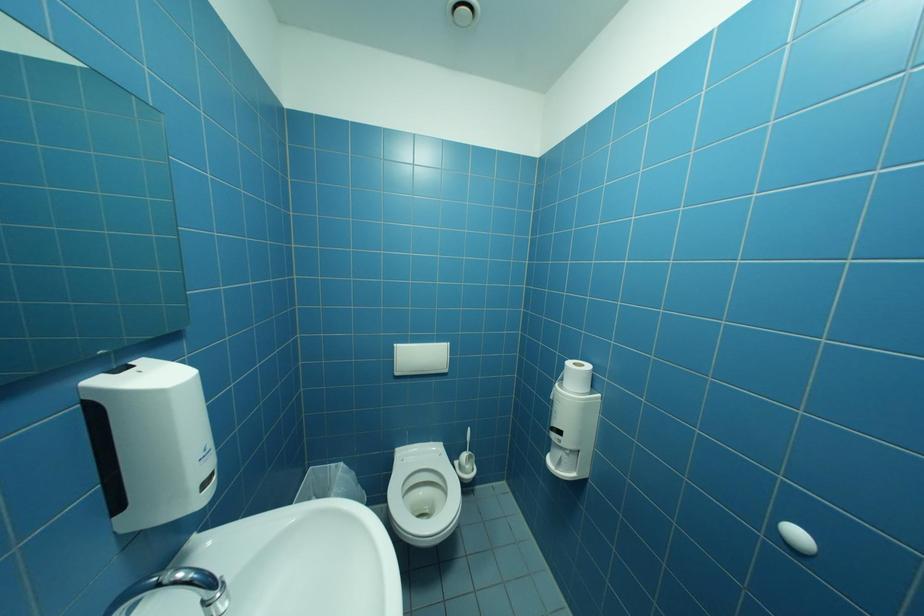
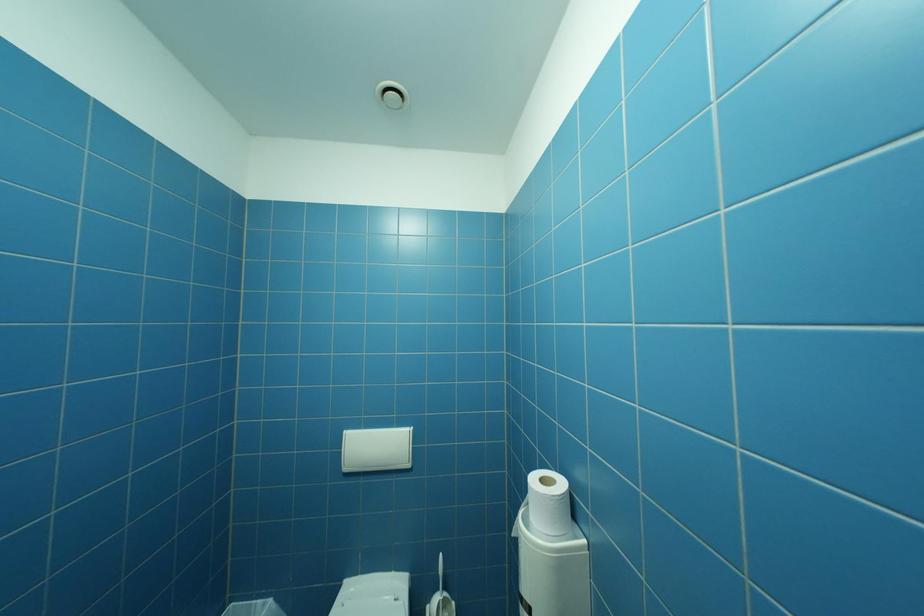
Which direction would the cameraman need to move to produce the second image?

The cameraman moved toward right, forward.